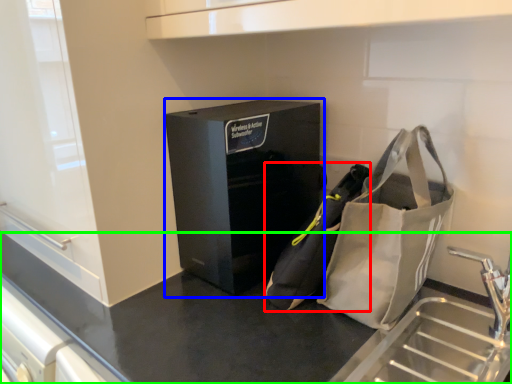
Question: Based on their relative distances, which object is farther from pouch (highlighted by a red box)? Choose from furniture (highlighted by a blue box) and counter (highlighted by a green box).

Choices:
 (A) furniture
 (B) counter

Answer: (B)